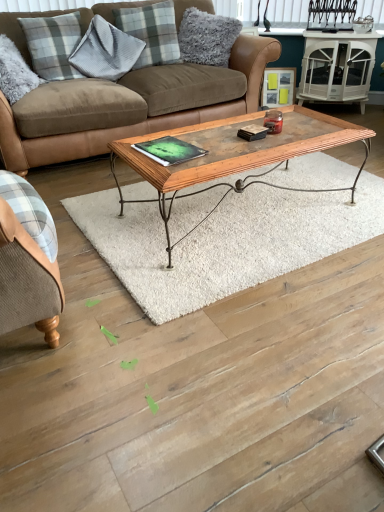
You are a GUI agent. You are given a task and a screenshot of the screen. Output one action in this format:
    pyautogui.click(x=<x>, y=<y>)
    Task: Click on the free spot above wooden table at center (from a real-world perspective)
    
    Given the screenshot: What is the action you would take?
    pyautogui.click(x=262, y=205)